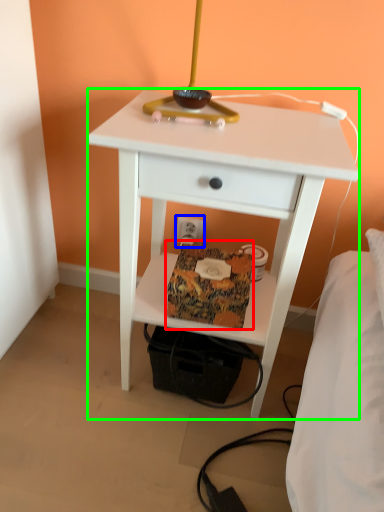
Question: Considering the real-world distances, which object is farthest from package (highlighted by a red box)? electric outlet (highlighted by a blue box) or nightstand (highlighted by a green box)?

Choices:
 (A) electric outlet
 (B) nightstand

Answer: (A)